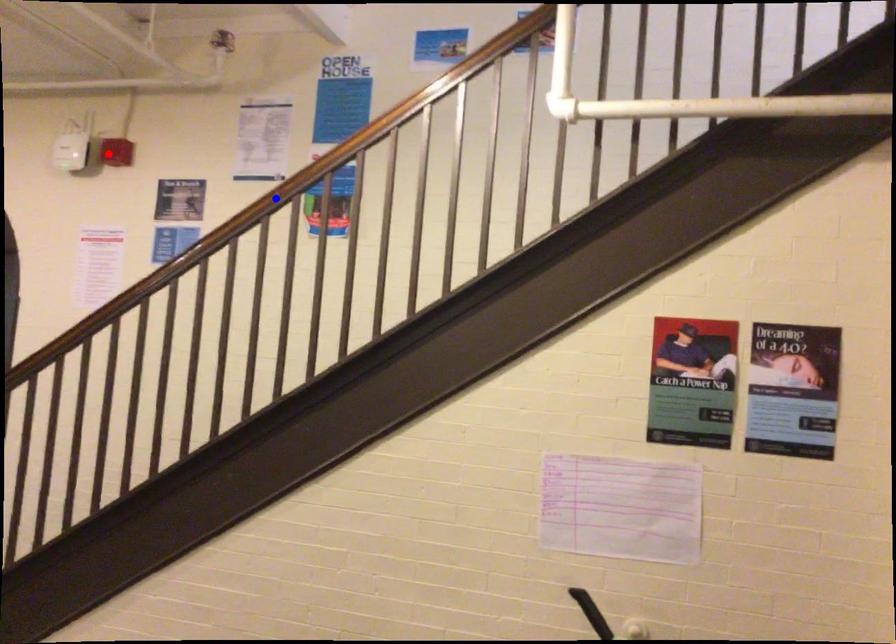
Question: In the image, two points are highlighted. Which point is nearer to the camera? Reply with the corresponding letter.

Choices:
 (A) blue point
 (B) red point

Answer: (A)